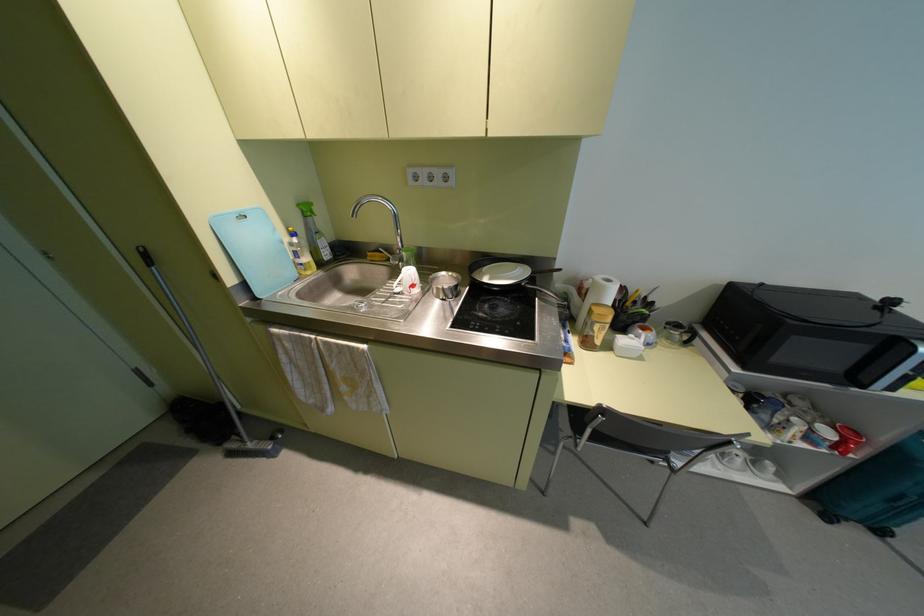
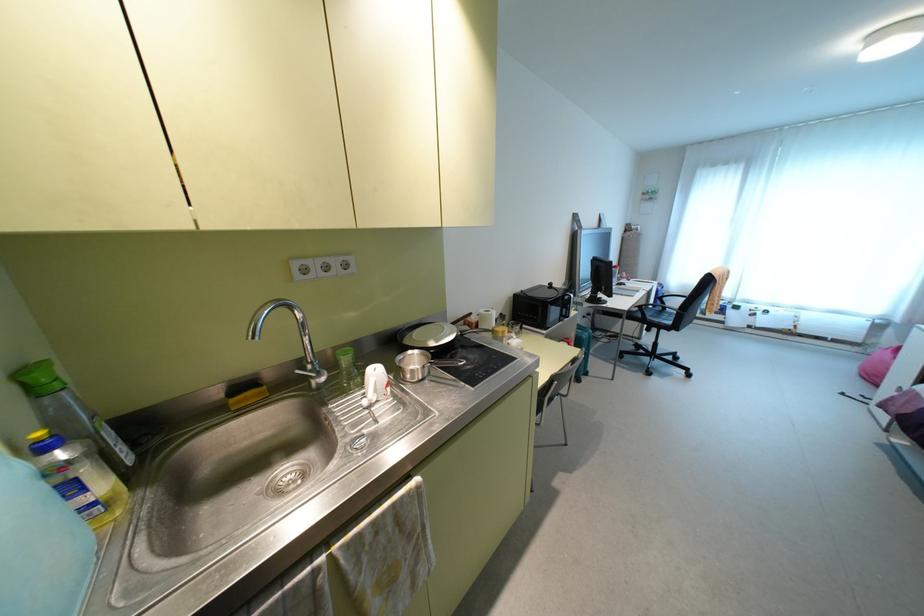
Find the pixel in the second image that matches the point at 293,233 in the first image.

(43, 447)